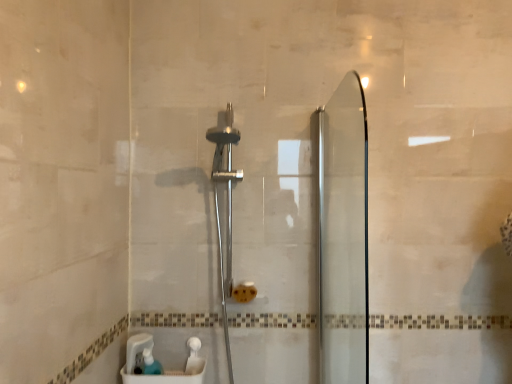
Question: From a real-world perspective, is translucent plastic soap dispenser at lower left on top of polished chrome shower head at center?

Choices:
 (A) yes
 (B) no

Answer: (B)

Question: From the image's perspective, would you say translucent plastic soap dispenser at lower left is shown under polished chrome shower head at center?

Choices:
 (A) no
 (B) yes

Answer: (B)

Question: Does translucent plastic soap dispenser at lower left have a lesser height compared to polished chrome shower head at center?

Choices:
 (A) yes
 (B) no

Answer: (A)

Question: From the image's perspective, is translucent plastic soap dispenser at lower left on polished chrome shower head at center?

Choices:
 (A) no
 (B) yes

Answer: (A)

Question: Can polished chrome shower head at center be found inside translucent plastic soap dispenser at lower left?

Choices:
 (A) no
 (B) yes

Answer: (A)

Question: Is translucent plastic soap dispenser at lower left taller than polished chrome shower head at center?

Choices:
 (A) no
 (B) yes

Answer: (A)

Question: Is translucent plastic container at lower center thinner than transparent glass screen door at right?

Choices:
 (A) yes
 (B) no

Answer: (B)

Question: Considering the relative sizes of translucent plastic container at lower center and transparent glass screen door at right in the image provided, is translucent plastic container at lower center shorter than transparent glass screen door at right?

Choices:
 (A) yes
 (B) no

Answer: (A)

Question: Is translucent plastic container at lower center surrounding transparent glass screen door at right?

Choices:
 (A) no
 (B) yes

Answer: (A)

Question: Does translucent plastic container at lower center have a larger size compared to transparent glass screen door at right?

Choices:
 (A) yes
 (B) no

Answer: (B)

Question: From the image's perspective, does translucent plastic container at lower center appear higher than transparent glass screen door at right?

Choices:
 (A) no
 (B) yes

Answer: (A)

Question: Considering the relative positions of translucent plastic container at lower center and transparent glass screen door at right in the image provided, is translucent plastic container at lower center to the left of transparent glass screen door at right from the viewer's perspective?

Choices:
 (A) no
 (B) yes

Answer: (B)

Question: Is translucent plastic container at lower center at the back of translucent plastic soap dispenser at lower left?

Choices:
 (A) yes
 (B) no

Answer: (A)